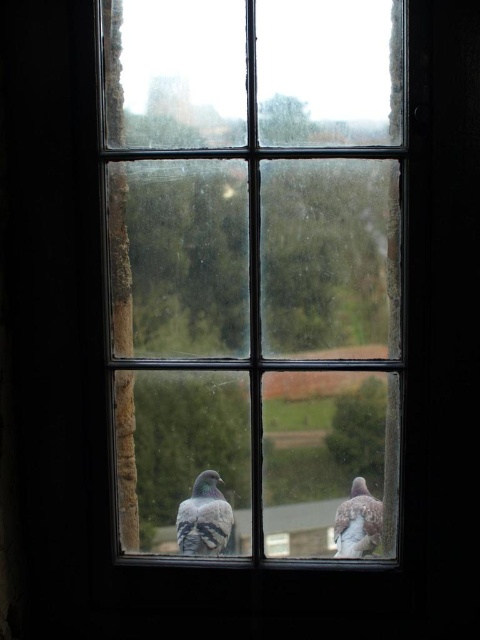
Question: Does clear glass window at center have a lesser width compared to green matte tree at lower right?

Choices:
 (A) no
 (B) yes

Answer: (A)

Question: Is gray speckled pigeon at lower center in front of speckled feathered bird at lower right?

Choices:
 (A) yes
 (B) no

Answer: (B)

Question: Estimate the real-world distances between objects in this image. Which object is closer to the clear glass window at center?

Choices:
 (A) green matte tree at lower right
 (B) gray speckled pigeon at lower center
 (C) speckled feathered bird at lower right

Answer: (A)

Question: Which of these objects is positioned farthest from the speckled feathered bird at lower right?

Choices:
 (A) gray speckled pigeon at lower center
 (B) green matte tree at lower right
 (C) clear glass window at center

Answer: (C)

Question: Which object is closer to the camera taking this photo?

Choices:
 (A) gray speckled pigeon at lower center
 (B) green matte tree at lower right
 (C) speckled feathered bird at lower right

Answer: (B)

Question: Is gray speckled pigeon at lower center thinner than speckled feathered bird at lower right?

Choices:
 (A) no
 (B) yes

Answer: (A)